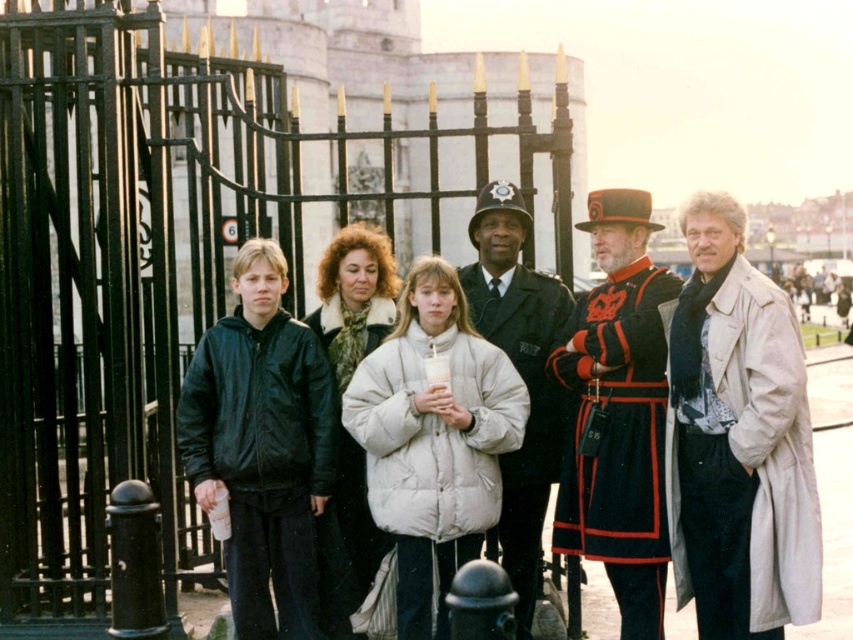
Which is in front, point (390, 346) or point (672, 280)?

Point (390, 346) is more forward.

Which is behind, point (466, 502) or point (641, 436)?

Positioned behind is point (641, 436).

Between point (407, 337) and point (554, 364), which one is positioned behind?

Point (554, 364)

Identify the location of white puffy coat at center. (433, 438).

Looking at this image, who is positioned more to the left, red velvet uniform at right or velvet black uniform at center?

From the viewer's perspective, velvet black uniform at center appears more on the left side.

Between point (720, 477) and point (654, 410), which one is positioned in front?

Point (720, 477) is more forward.

I want to click on red velvet uniform at right, so click(x=738, y=440).

Who is positioned more to the right, red velvet uniform at right or white puffy coat at center?

red velvet uniform at right is more to the right.

Who is more forward, (747, 577) or (497, 365)?

Point (747, 577) is in front.

Who is more distant from viewer, (x=715, y=273) or (x=448, y=305)?

A: The point (x=448, y=305) is behind.

The width and height of the screenshot is (853, 640). I want to click on red velvet uniform at right, so click(738, 440).